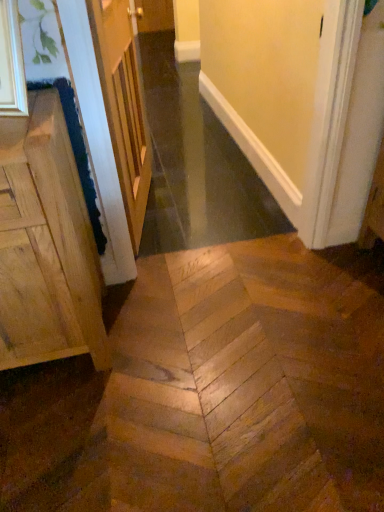
Question: Is wooden door at upper left inside natural wood cabinet at left?

Choices:
 (A) yes
 (B) no

Answer: (B)

Question: Is natural wood cabinet at left to the right of wooden door at upper left from the viewer's perspective?

Choices:
 (A) no
 (B) yes

Answer: (A)

Question: From the image's perspective, is natural wood cabinet at left below wooden door at upper left?

Choices:
 (A) yes
 (B) no

Answer: (A)

Question: Is natural wood cabinet at left oriented away from wooden door at upper left?

Choices:
 (A) no
 (B) yes

Answer: (A)

Question: Does natural wood cabinet at left have a lesser height compared to wooden door at upper left?

Choices:
 (A) yes
 (B) no

Answer: (A)

Question: From the image's perspective, is natural wood cabinet at left on wooden door at upper left?

Choices:
 (A) no
 (B) yes

Answer: (A)

Question: Is wooden door at upper left shorter than natural wood cabinet at left?

Choices:
 (A) yes
 (B) no

Answer: (B)

Question: Is natural wood cabinet at left inside wooden door at upper left?

Choices:
 (A) no
 (B) yes

Answer: (A)

Question: From the image's perspective, is wooden door at upper left above natural wood cabinet at left?

Choices:
 (A) yes
 (B) no

Answer: (A)

Question: Does wooden door at upper left have a smaller size compared to natural wood cabinet at left?

Choices:
 (A) no
 (B) yes

Answer: (B)

Question: Is wooden door at upper left next to natural wood cabinet at left?

Choices:
 (A) yes
 (B) no

Answer: (B)

Question: Is the depth of wooden door at upper left less than that of natural wood cabinet at left?

Choices:
 (A) yes
 (B) no

Answer: (B)

Question: Does point (142, 169) appear closer or farther from the camera than point (77, 179)?

Choices:
 (A) closer
 (B) farther

Answer: (B)